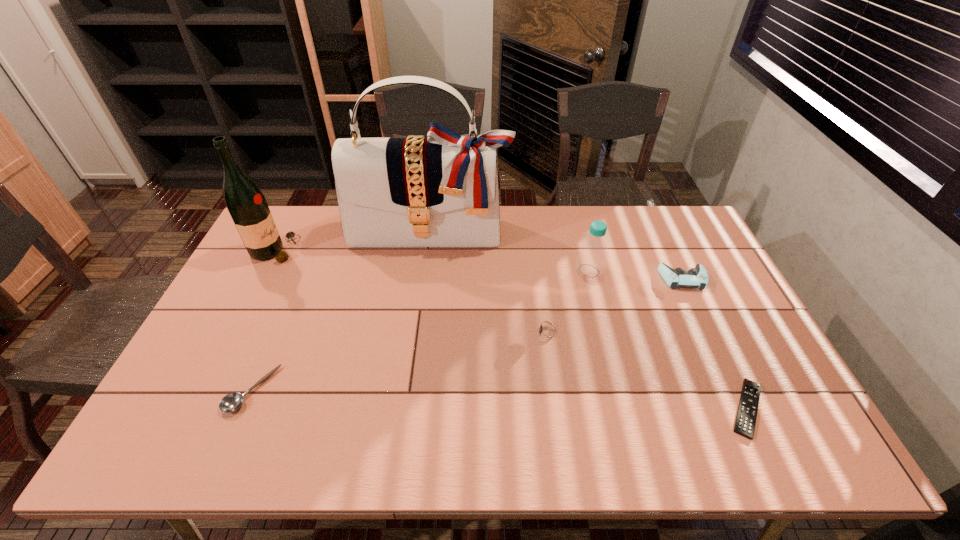
Find the location of a particular element. Image resolution: width=960 pixels, height=540 pixels. wine bottle that is at the far edge is located at coordinates (248, 208).

Find the location of a particular element. object at the near edge is located at coordinates (745, 421).

Where is `wine bottle that is at the left edge`? The height and width of the screenshot is (540, 960). wine bottle that is at the left edge is located at coordinates (248, 208).

Find the location of `ladle present at the left edge`. ladle present at the left edge is located at coordinates (231, 402).

Locate an element on the screen. The width and height of the screenshot is (960, 540). control that is at the right edge is located at coordinates (697, 277).

Where is `remote control that is at the right edge`? remote control that is at the right edge is located at coordinates (745, 421).

You are a GUI agent. You are given a task and a screenshot of the screen. Output one action in this format:
    pyautogui.click(x=<x>, y=<y>)
    Task: Click on the object situated at the far left corner
    The width and height of the screenshot is (960, 540).
    Given the screenshot: What is the action you would take?
    pyautogui.click(x=248, y=208)

The height and width of the screenshot is (540, 960). What are the coordinates of `object present at the near right corner` in the screenshot? It's located at (745, 421).

In the image, there is a desktop. What are the coordinates of `vacant space at the far edge` in the screenshot? It's located at (502, 238).

This screenshot has width=960, height=540. I want to click on vacant region at the near edge, so click(320, 429).